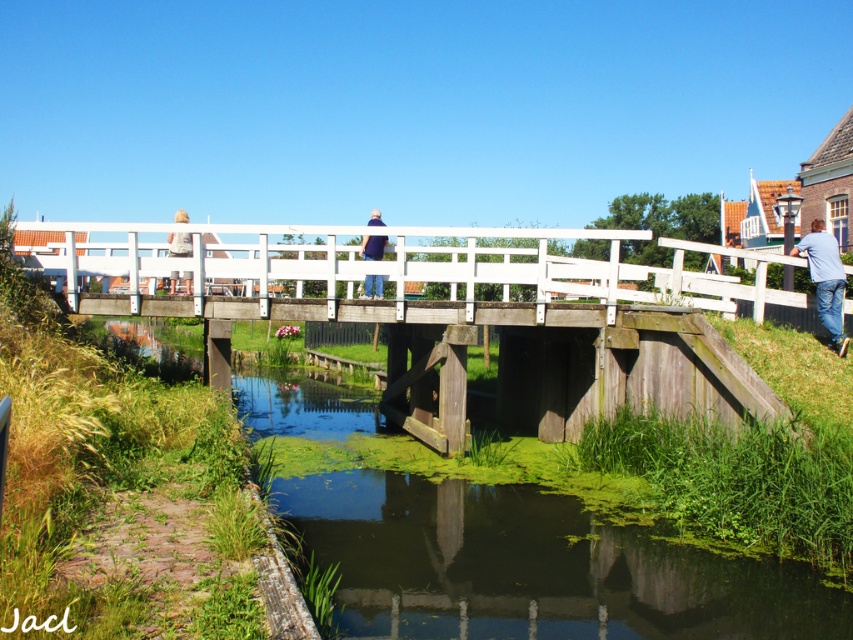
You are standing on the wooden bridge and see the blue fabric shirt at center and the light brown wooden chair at upper center. Which object is closer to you?

The blue fabric shirt at center is closer to you because it is in front of the light brown wooden chair at upper center.